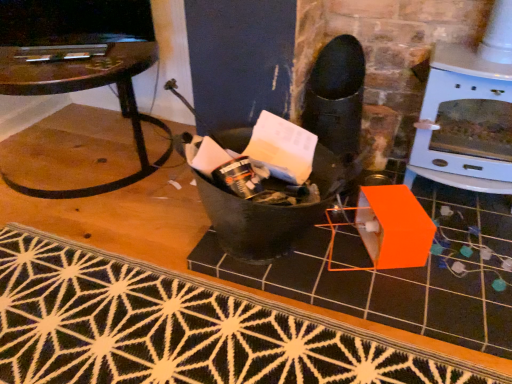
The height and width of the screenshot is (384, 512). What do you see at coordinates (87, 89) in the screenshot? I see `clear glass table at left` at bounding box center [87, 89].

The width and height of the screenshot is (512, 384). I want to click on black matte tile at center, so click(402, 275).

What is the approximate height of black matte tile at center?

Result: 1.97 inches.

The image size is (512, 384). I want to click on white glossy fireplace at upper right, so click(466, 99).

From the image's perspective, which is above, white glossy fireplace at upper right or clear glass table at left?

From the image's view, clear glass table at left is above.

Looking at this image, between white glossy fireplace at upper right and clear glass table at left, which one appears on the right side from the viewer's perspective?

white glossy fireplace at upper right is more to the right.

Is white glossy fireplace at upper right oriented away from clear glass table at left?

No, white glossy fireplace at upper right's orientation is not away from clear glass table at left.

From the image's perspective, relative to black matte tile at center, is black textured rug at lower center above or below?

From the image's perspective, black textured rug at lower center appears below black matte tile at center.

Does black textured rug at lower center have a larger size compared to black matte tile at center?

Correct, black textured rug at lower center is larger in size than black matte tile at center.

Could you tell me if black textured rug at lower center is facing black matte tile at center?

No, black textured rug at lower center is not facing towards black matte tile at center.

Is black matte tile at center surrounded by black textured rug at lower center?

No, black matte tile at center is not surrounded by black textured rug at lower center.

Looking at this image, from the image's perspective, is clear glass table at left over black matte tile at center?

Yes, from the image's perspective, clear glass table at left is above black matte tile at center.

From a real-world perspective, is clear glass table at left located beneath black matte tile at center?

No, from a real-world perspective, clear glass table at left is not below black matte tile at center.

Consider the image. Considering the relative sizes of clear glass table at left and black matte tile at center in the image provided, is clear glass table at left bigger than black matte tile at center?

Yes, clear glass table at left is bigger than black matte tile at center.

Can you tell me how much white glossy fireplace at upper right and black textured rug at lower center differ in facing direction?

There is a 92.5-degree angle between the facing directions of white glossy fireplace at upper right and black textured rug at lower center.

From a real-world perspective, is white glossy fireplace at upper right located higher than black textured rug at lower center?

Yes.

From the picture: Is white glossy fireplace at upper right at the right side of black textured rug at lower center?

Yes.

Looking at this image, measure the distance between white glossy fireplace at upper right and black textured rug at lower center.

The distance of white glossy fireplace at upper right from black textured rug at lower center is 88.97 centimeters.

From the image's perspective, which is above, black matte tile at center or white glossy fireplace at upper right?

white glossy fireplace at upper right appears higher in the image.

Is black matte tile at center positioned with its back to white glossy fireplace at upper right?

No.

Is white glossy fireplace at upper right surrounded by black matte tile at center?

No, white glossy fireplace at upper right is not a part of black matte tile at center.

Is black matte tile at center taller or shorter than white glossy fireplace at upper right?

black matte tile at center is shorter than white glossy fireplace at upper right.

Is black textured rug at lower center aimed at clear glass table at left?

No, black textured rug at lower center is not oriented towards clear glass table at left.

Which is in front, point (381, 352) or point (8, 61)?

The point (381, 352) is closer.

From a real-world perspective, is black textured rug at lower center positioned over clear glass table at left based on gravity?

No, from a real-world perspective, black textured rug at lower center is not above clear glass table at left.

Is black matte tile at center further to camera compared to black textured rug at lower center?

Yes, black matte tile at center is further from the camera.

Image resolution: width=512 pixels, height=384 pixels. In order to click on doormat below the black matte tile at center (from a real-world perspective) in this screenshot , I will do `click(178, 329)`.

From the picture: From a real-world perspective, who is located lower, black matte tile at center or black textured rug at lower center?

black textured rug at lower center.

Which is behind, point (461, 228) or point (119, 299)?

The point (461, 228) is farther.

You are a GUI agent. You are given a task and a screenshot of the screen. Output one action in this format:
    pyautogui.click(x=<x>, y=<y>)
    Task: Click on the table behind the white glossy fireplace at upper right
    
    Given the screenshot: What is the action you would take?
    pyautogui.click(x=87, y=89)

Where is `doormat that appears in front of the black matte tile at center`? doormat that appears in front of the black matte tile at center is located at coordinates (178, 329).

From the image, which object appears to be nearer to white glossy fireplace at upper right, black textured rug at lower center or clear glass table at left?

black textured rug at lower center.

Estimate the real-world distances between objects in this image. Which object is closer to black textured rug at lower center, clear glass table at left or white glossy fireplace at upper right?

Among the two, clear glass table at left is located nearer to black textured rug at lower center.

Which object lies nearer to the anchor point black textured rug at lower center, clear glass table at left or black matte tile at center?

black matte tile at center lies closer to black textured rug at lower center than the other object.

From the image, which object appears to be farther from clear glass table at left, black matte tile at center or black textured rug at lower center?

black matte tile at center is further to clear glass table at left.

Which object lies nearer to the anchor point white glossy fireplace at upper right, black textured rug at lower center or black matte tile at center?

Based on the image, black matte tile at center appears to be nearer to white glossy fireplace at upper right.

Which object lies nearer to the anchor point black matte tile at center, black textured rug at lower center or white glossy fireplace at upper right?

black textured rug at lower center lies closer to black matte tile at center than the other object.

Considering their positions, is white glossy fireplace at upper right positioned closer to black textured rug at lower center than clear glass table at left?

clear glass table at left is closer to black textured rug at lower center.

From the image, which object appears to be farther from clear glass table at left, white glossy fireplace at upper right or black textured rug at lower center?

white glossy fireplace at upper right is positioned further to the anchor clear glass table at left.

Identify the location of doormat between clear glass table at left and black matte tile at center. (178, 329).

Image resolution: width=512 pixels, height=384 pixels. I want to click on doormat located between clear glass table at left and white glossy fireplace at upper right in the left-right direction, so click(x=178, y=329).

This screenshot has width=512, height=384. Find the location of `tile between clear glass table at left and white glossy fireplace at upper right`. tile between clear glass table at left and white glossy fireplace at upper right is located at coordinates (402, 275).

This screenshot has width=512, height=384. I want to click on tile between black textured rug at lower center and white glossy fireplace at upper right in the horizontal direction, so click(x=402, y=275).